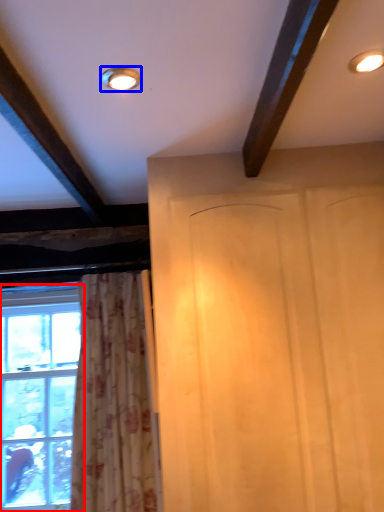
Question: Which point is closer to the camera, window (highlighted by a red box) or lighting (highlighted by a blue box)?

Choices:
 (A) window
 (B) lighting

Answer: (B)